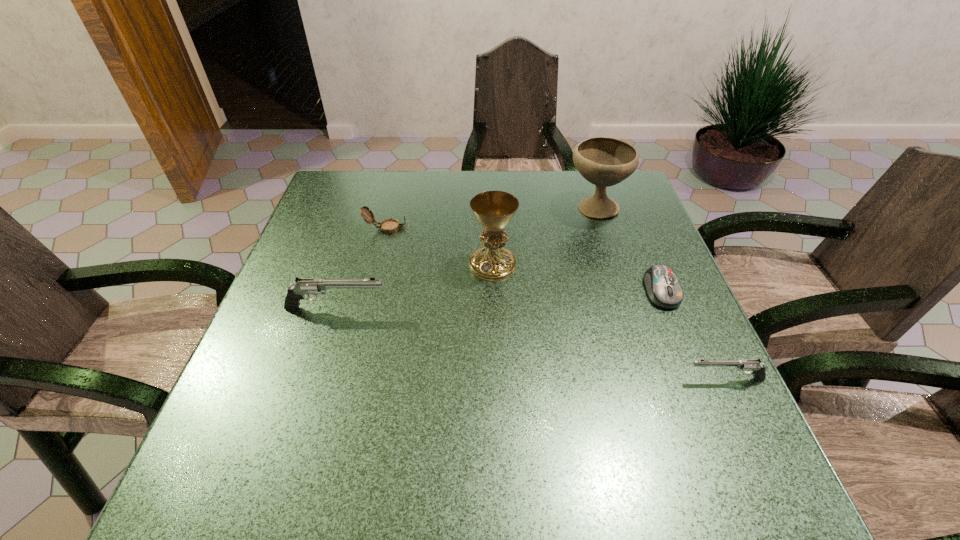
The width and height of the screenshot is (960, 540). What are the coordinates of `vacant space that is in between the fourth object from right to left and the compass` in the screenshot? It's located at (440, 247).

Find the location of a particular element. The image size is (960, 540). vacant area between the shortest object and the left pistol is located at coordinates (498, 299).

You are a GUI agent. You are given a task and a screenshot of the screen. Output one action in this format:
    pyautogui.click(x=<x>, y=<y>)
    Task: Click on the free space that is in between the computer mouse and the farther chalice
    
    Given the screenshot: What is the action you would take?
    pyautogui.click(x=628, y=249)

Where is `free space that is in between the right pistol and the shortest object`? free space that is in between the right pistol and the shortest object is located at coordinates (693, 335).

Image resolution: width=960 pixels, height=540 pixels. I want to click on free space between the shortest object and the compass, so click(x=524, y=259).

Find the location of a particular element. The width and height of the screenshot is (960, 540). vacant area between the left pistol and the shortest object is located at coordinates (498, 299).

You are a GUI agent. You are given a task and a screenshot of the screen. Output one action in this format:
    pyautogui.click(x=<x>, y=<y>)
    Task: Click on the vacant region between the nearer pistol and the left pistol
    This screenshot has width=960, height=540.
    Given the screenshot: What is the action you would take?
    pyautogui.click(x=531, y=343)

What are the coordinates of `object that is the second nearest to the right chalice` in the screenshot? It's located at (663, 288).

Locate which object is the fifth closest to the right pistol. Please provide its 2D coordinates. Your answer should be formatted as a tuple, i.e. [(x, y)], where the tuple contains the x and y coordinates of a point satisfying the conditions above.

[(388, 226)]

Locate an element on the screen. The image size is (960, 540). free space that satisfies the following two spatial constraints: 1. on the wheel side of the computer mouse; 2. on the front-facing side of the taller pistol is located at coordinates (668, 308).